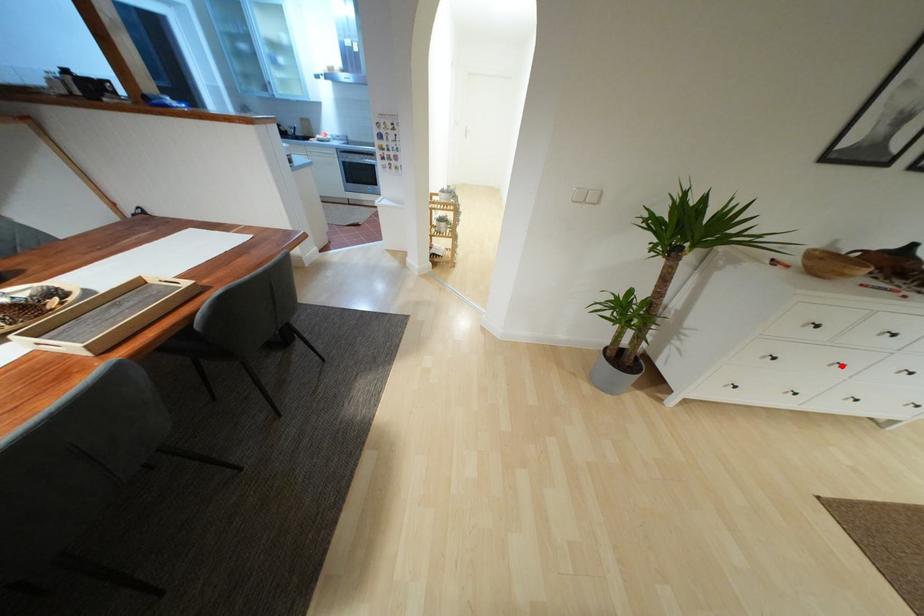
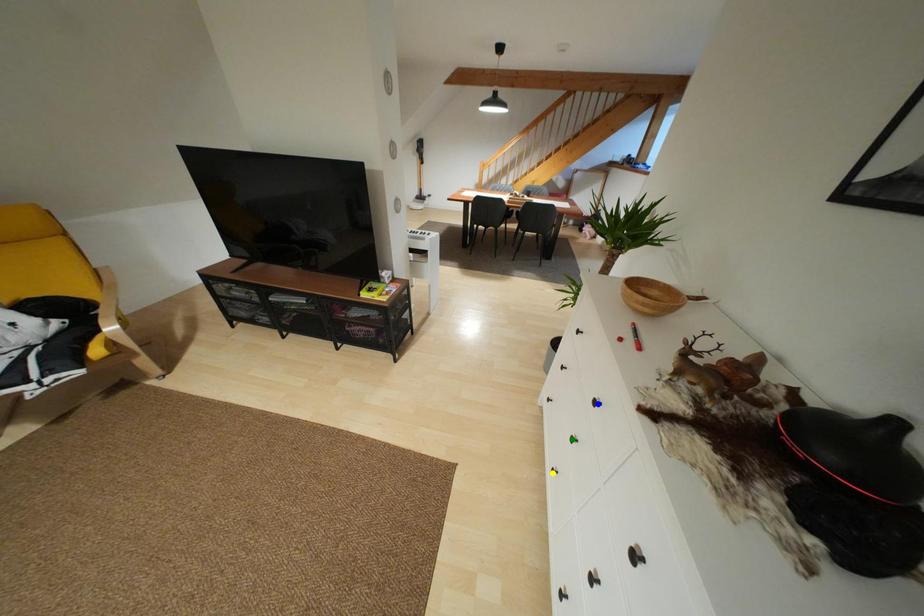
Question: I am providing you with two images of the same scene from different viewpoints. A red point is marked on the first image. You are given multiple points on the second image. Which mark in image 2 goes with the point in image 1?

Choices:
 (A) green point
 (B) yellow point
 (C) blue point

Answer: (A)